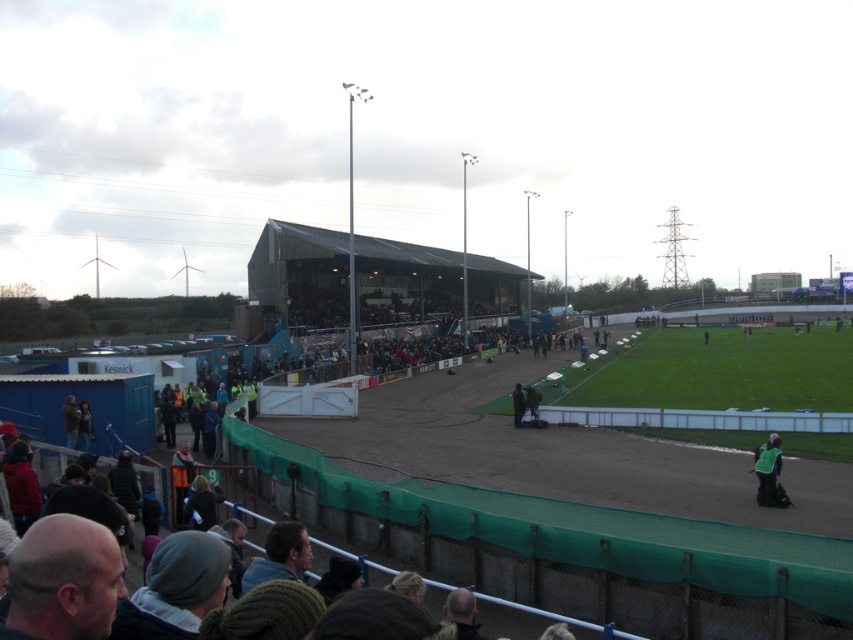
You are a safety inspector at the stadium and need to ensure visibility of safety equipment. You see the green reflective vest at lower right and the dark green fabric at center. Which one is taller?

The green reflective vest at lower right is taller than the dark green fabric at center.

You are a spectator at the stadium and want to locate the green reflective vest at lower right and the dark green fabric at center. Which object is nearer to you?

The green reflective vest at lower right is closer to the viewer than the dark green fabric at center.